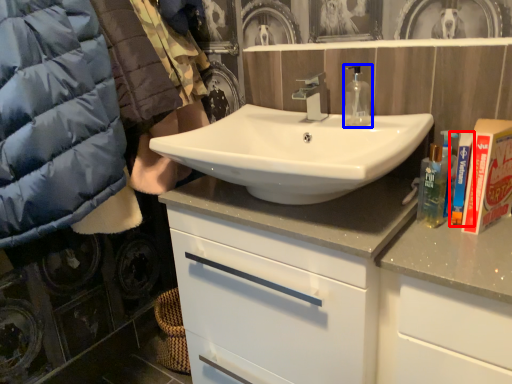
Question: Which point is closer to the camera, toiletry (highlighted by a red box) or mouthwash (highlighted by a blue box)?

Choices:
 (A) toiletry
 (B) mouthwash

Answer: (A)